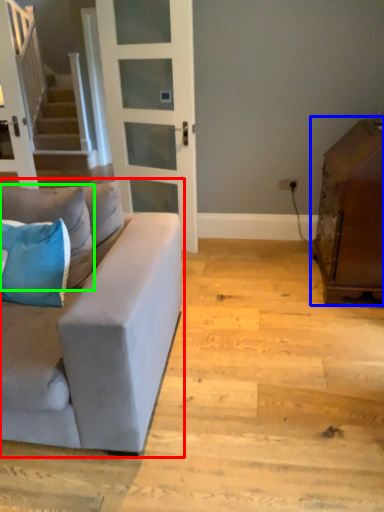
Question: Which object is positioned closest to studio couch (highlighted by a red box)? Select from cabinetry (highlighted by a blue box) and pillow (highlighted by a green box).

Choices:
 (A) cabinetry
 (B) pillow

Answer: (B)